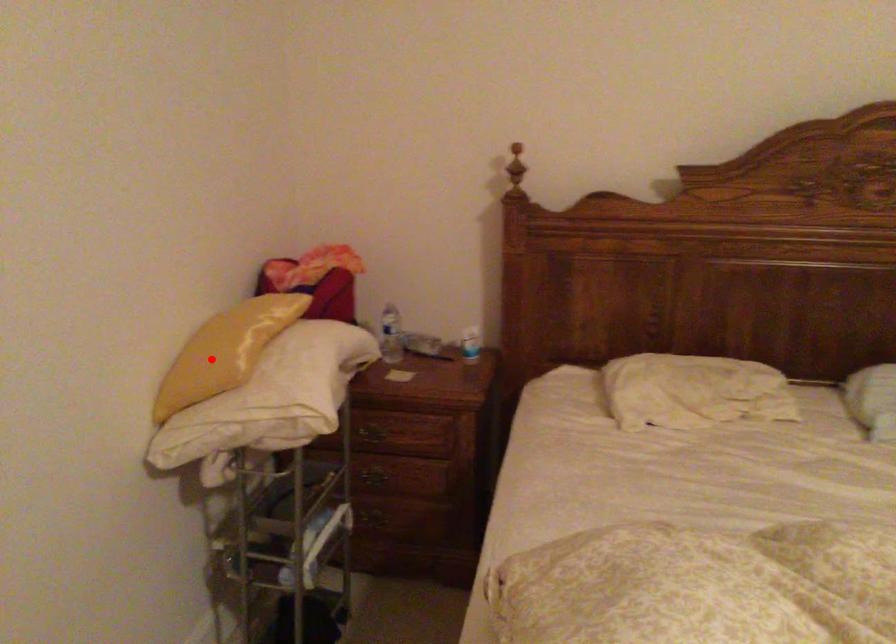
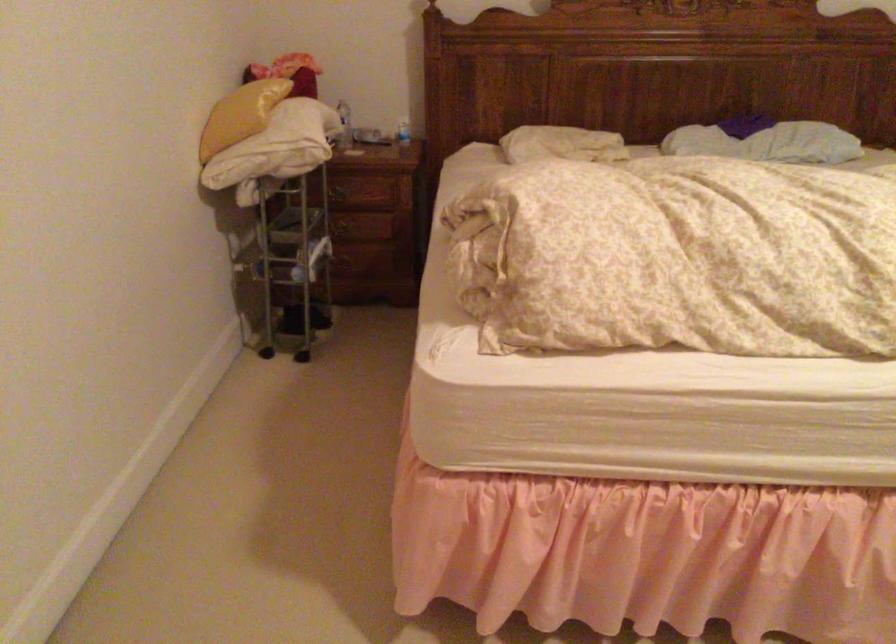
Question: I am providing you with two images of the same scene from different viewpoints. Given a red point in image1, look at the same physical point in image2. Is it:

Choices:
 (A) Closer to the viewpoint
 (B) Farther from the viewpoint

Answer: (B)